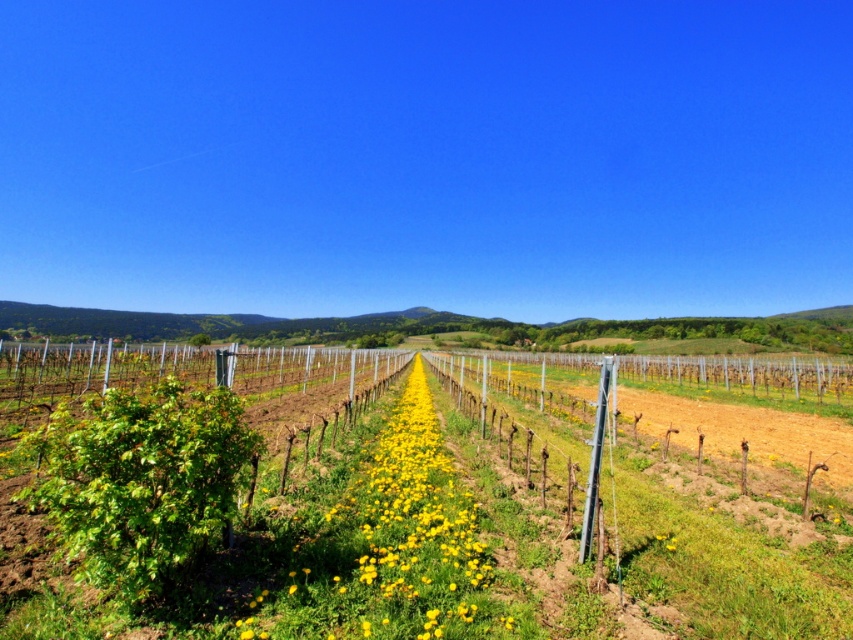
Question: Can you confirm if green leafy vines at center is smaller than yellow soft-textured flowers at center?

Choices:
 (A) no
 (B) yes

Answer: (A)

Question: Does green leafy vines at center appear on the right side of yellow soft-textured flowers at center?

Choices:
 (A) yes
 (B) no

Answer: (B)

Question: Which object appears closest to the camera in this image?

Choices:
 (A) green leafy vines at center
 (B) yellow soft-textured flowers at center

Answer: (A)

Question: Can you confirm if green leafy vines at center is bigger than yellow soft-textured flowers at center?

Choices:
 (A) no
 (B) yes

Answer: (B)

Question: Which point appears closest to the camera in this image?

Choices:
 (A) (296, 540)
 (B) (451, 381)

Answer: (A)